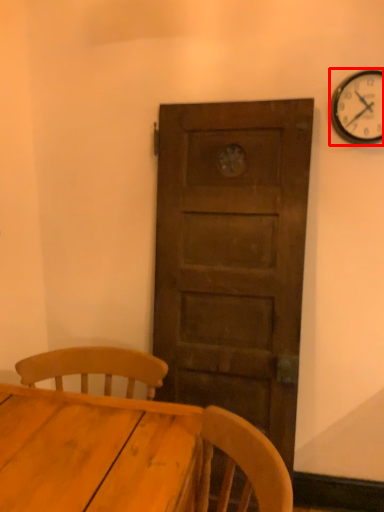
Question: Considering the relative positions of wall clock (annotated by the red box) and table in the image provided, where is wall clock (annotated by the red box) located with respect to the staircase?

Choices:
 (A) right
 (B) left

Answer: (A)